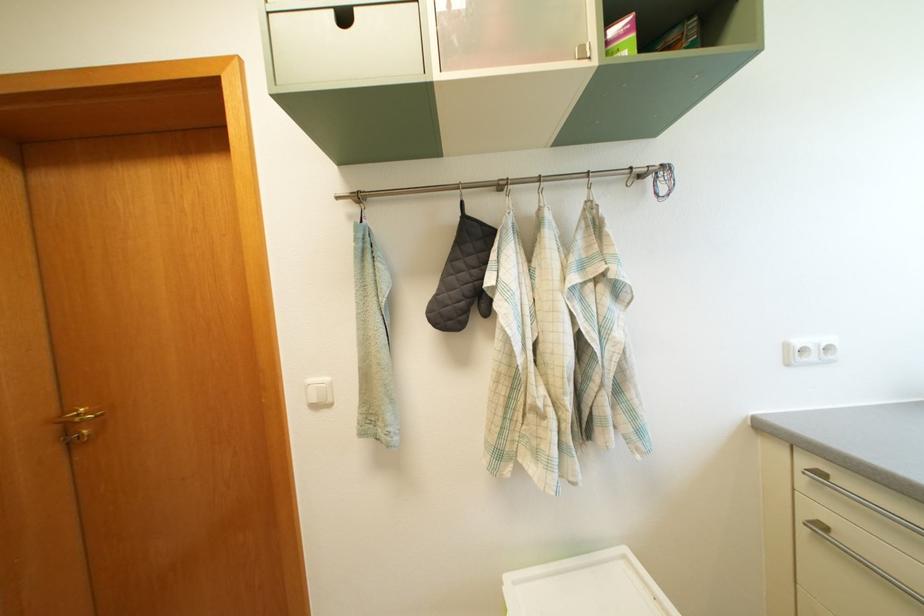
Locate an element on the screen. This screenshot has height=616, width=924. cabinet drawer cutout is located at coordinates (854, 544).